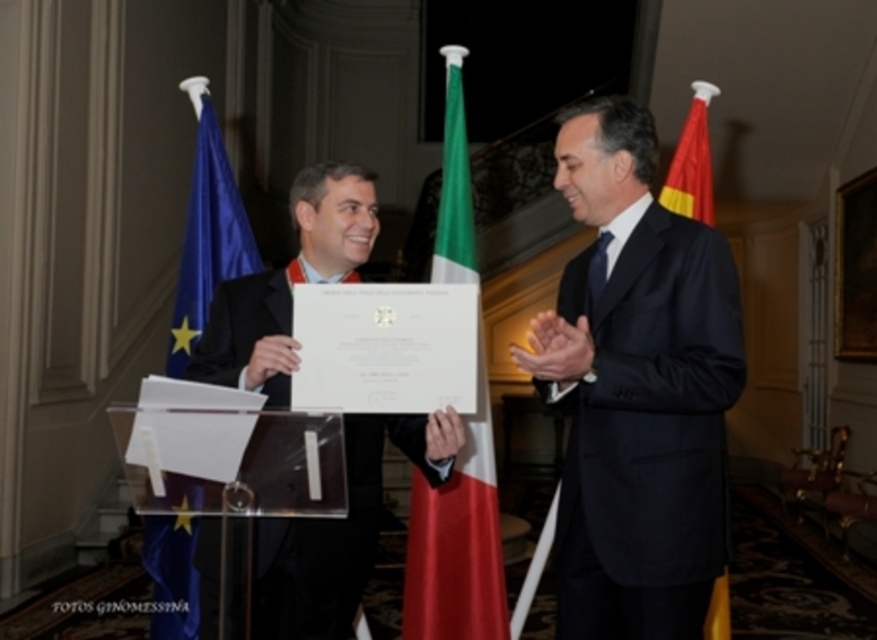
Who is positioned more to the left, blue fabric flag at left or red fabric flag at right?

Positioned to the left is blue fabric flag at left.

Is blue fabric flag at left above red fabric flag at right?

Actually, blue fabric flag at left is below red fabric flag at right.

This screenshot has width=877, height=640. What do you see at coordinates (208, 240) in the screenshot?
I see `blue fabric flag at left` at bounding box center [208, 240].

Where is `blue fabric flag at left`? The height and width of the screenshot is (640, 877). blue fabric flag at left is located at coordinates (208, 240).

Does matte black suit at center appear on the right side of blue fabric flag at left?

Indeed, matte black suit at center is positioned on the right side of blue fabric flag at left.

The width and height of the screenshot is (877, 640). What do you see at coordinates (340, 531) in the screenshot?
I see `matte black suit at center` at bounding box center [340, 531].

Describe the element at coordinates (340, 531) in the screenshot. Image resolution: width=877 pixels, height=640 pixels. I see `matte black suit at center` at that location.

This screenshot has width=877, height=640. Find the location of `matte black suit at center`. matte black suit at center is located at coordinates (340, 531).

Who is higher up, black suit at center or blue fabric flag at left?

blue fabric flag at left is higher up.

Which is more to the left, black suit at center or blue fabric flag at left?

blue fabric flag at left

Measure the distance between black suit at center and camera.

black suit at center is 8.44 feet from camera.

Image resolution: width=877 pixels, height=640 pixels. Find the location of `black suit at center`. black suit at center is located at coordinates (637, 388).